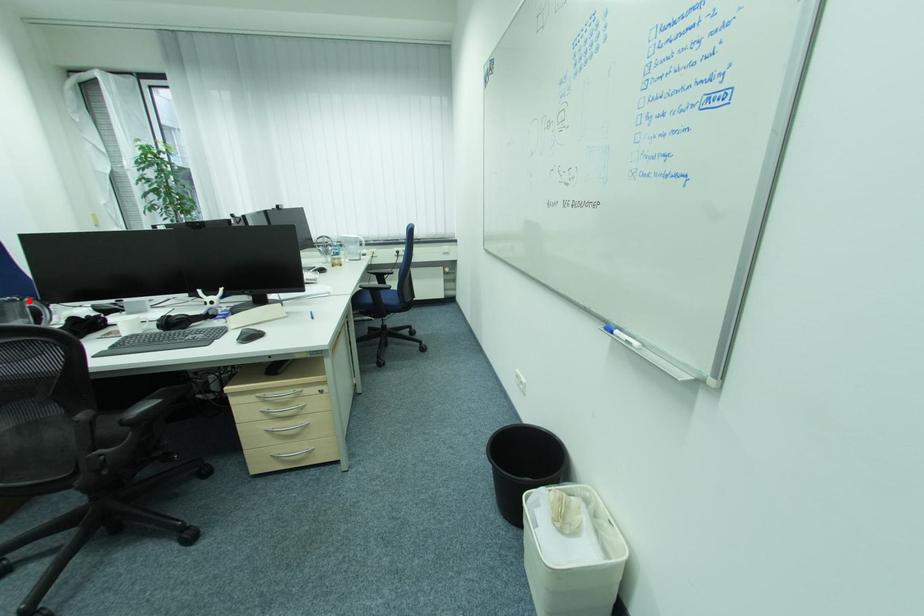
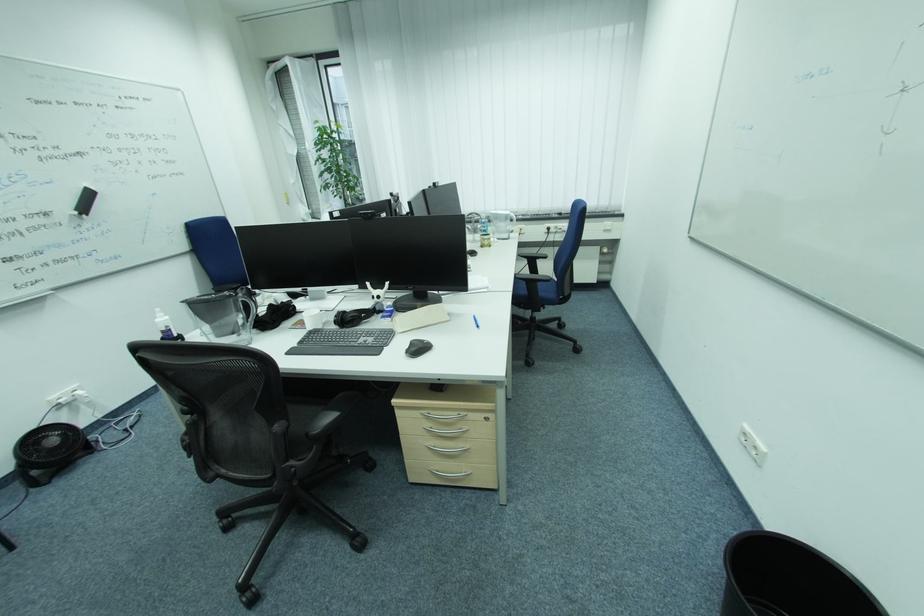
Locate, in the second image, the point that corresponds to the highlighted location in the first image.

(242, 294)